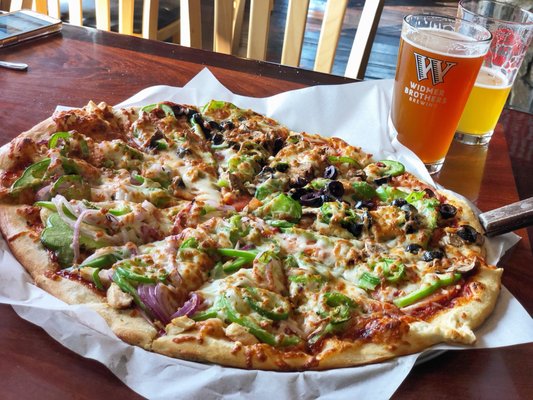
I want to click on phone, so click(30, 33).